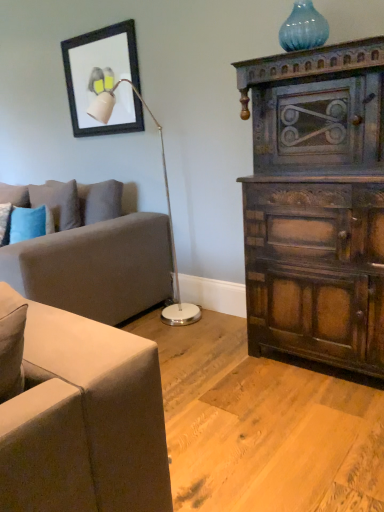
Question: Is point (82, 98) positioned closer to the camera than point (51, 203)?

Choices:
 (A) farther
 (B) closer

Answer: (A)

Question: From their relative heights in the image, would you say matte black picture frame at upper left is taller or shorter than blue textured pillow at left?

Choices:
 (A) tall
 (B) short

Answer: (A)

Question: Which of these objects is positioned farthest from the blue glass vase at upper right?

Choices:
 (A) white glossy floor lamp at upper left
 (B) soft gray fabric couch at left
 (C) blue textured pillow at left
 (D) matte black picture frame at upper left
 (E) dark wood cabinet at right

Answer: (C)

Question: Considering the real-world distances, which object is farthest from the blue textured pillow at left?

Choices:
 (A) white glossy floor lamp at upper left
 (B) blue glass vase at upper right
 (C) soft gray fabric couch at left
 (D) dark wood cabinet at right
 (E) matte black picture frame at upper left

Answer: (B)